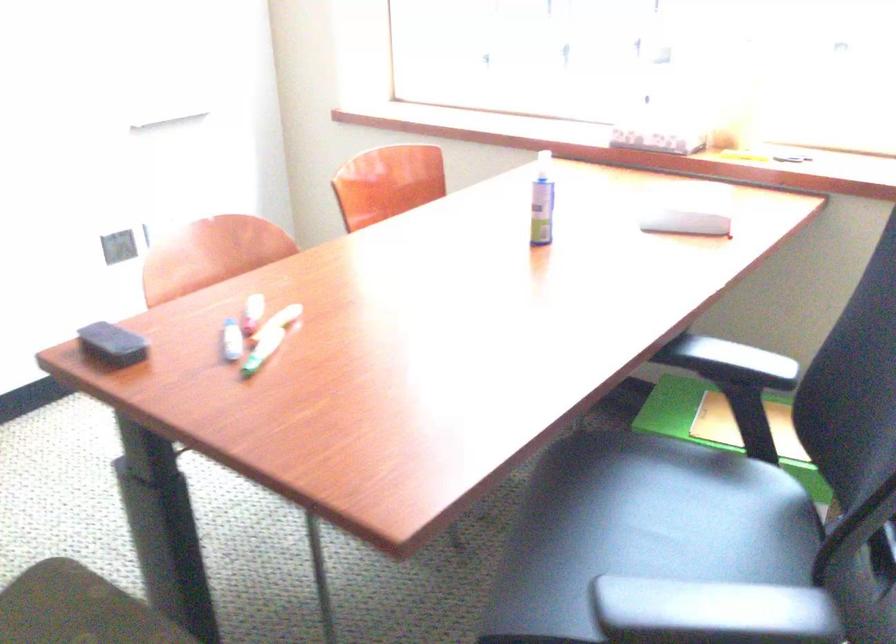
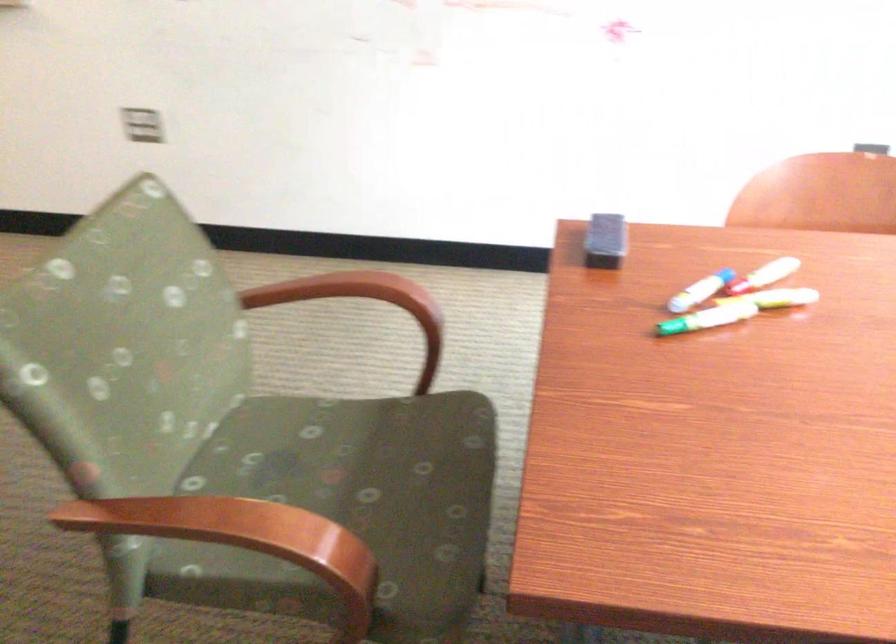
Locate, in the second image, the point that corresponds to [154,231] in the first image.

(871, 147)